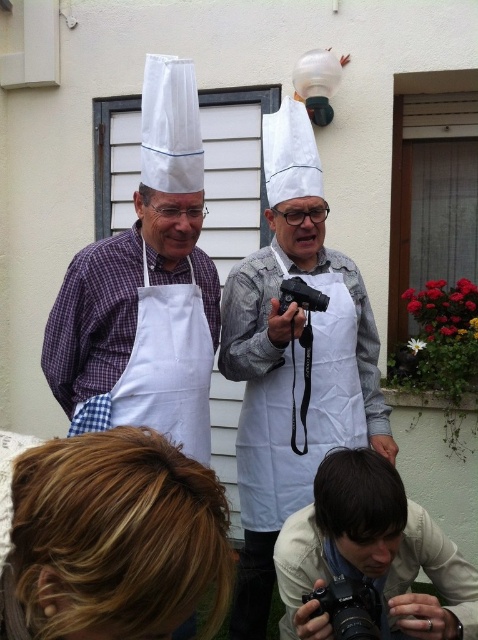
This screenshot has width=478, height=640. I want to click on matte white camera at center, so click(x=371, y=554).

Between point (417, 600) and point (315, 296), which one is positioned behind?

Point (315, 296)

Locate an element on the screen. The height and width of the screenshot is (640, 478). matte white camera at center is located at coordinates (371, 554).

Is white fabric apron at left thinner than black rubber camera at center?

In fact, white fabric apron at left might be wider than black rubber camera at center.

This screenshot has height=640, width=478. What are the coordinates of `white fabric apron at left` in the screenshot? It's located at (169, 365).

The image size is (478, 640). Find the location of `white fabric apron at left`. white fabric apron at left is located at coordinates (169, 365).

Between black plastic camera at lower center and black rubber camera at center, which one has less height?

black rubber camera at center

Does black plastic camera at lower center have a smaller size compared to black rubber camera at center?

Actually, black plastic camera at lower center might be larger than black rubber camera at center.

Image resolution: width=478 pixels, height=640 pixels. Identify the location of black plastic camera at lower center. (348, 608).